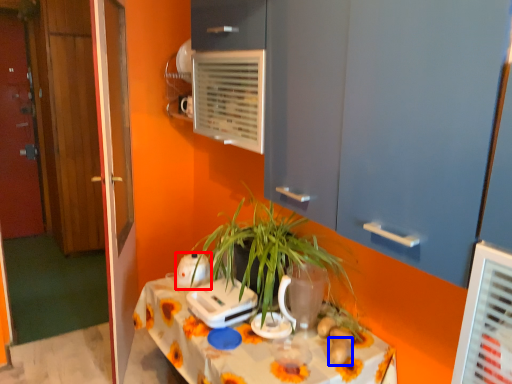
Question: Which object appears closest to the camera in this image, appliance (highlighted by a red box) or food (highlighted by a blue box)?

Choices:
 (A) appliance
 (B) food

Answer: (B)